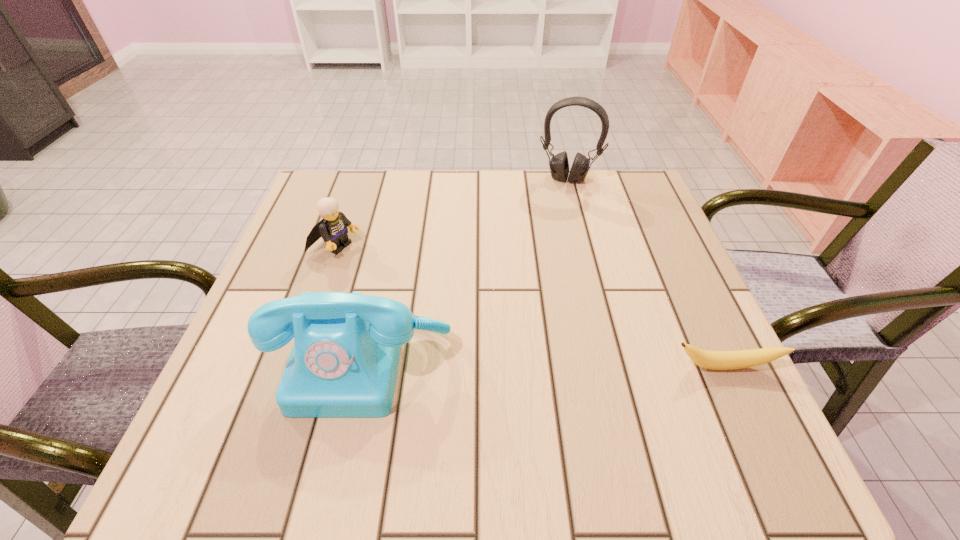
The image size is (960, 540). In order to click on free spot located on the front-facing side of the third tallest object in this screenshot , I will do `click(454, 299)`.

Locate an element on the screen. This screenshot has height=540, width=960. vacant region located 0.380m on the front-facing side of the headset is located at coordinates click(x=535, y=284).

I want to click on free space located 0.240m on the front-facing side of the headset, so click(x=546, y=242).

The height and width of the screenshot is (540, 960). I want to click on vacant space located on the front-facing side of the headset, so click(540, 268).

Image resolution: width=960 pixels, height=540 pixels. In order to click on object at the far edge in this screenshot , I will do `click(559, 166)`.

Locate an element on the screen. telephone present at the near edge is located at coordinates (344, 361).

At what (x,y) coordinates should I click in order to perform the action: click on banana situated at the near edge. Please return your answer as a coordinate pair (x, y). This screenshot has width=960, height=540. Looking at the image, I should click on (715, 360).

In order to click on telephone at the left edge in this screenshot , I will do click(x=344, y=361).

Identify the location of Lego present at the left edge. This screenshot has width=960, height=540. (332, 228).

Locate an element on the screen. The image size is (960, 540). banana present at the right edge is located at coordinates (715, 360).